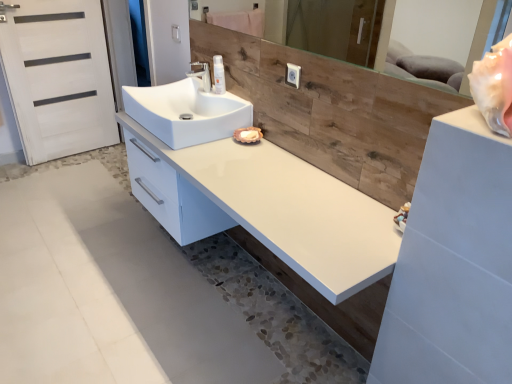
Find the location of a particular element. The width and height of the screenshot is (512, 384). vacant space in front of white glossy sink at center is located at coordinates click(x=217, y=160).